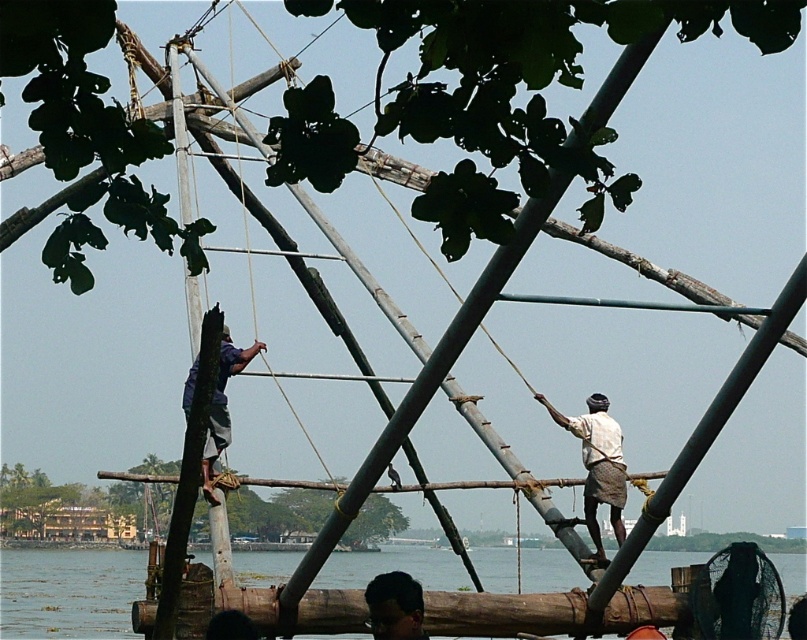
Is clear water at lower left positioned behind white cotton shirt at right?

Yes, it is behind white cotton shirt at right.

Who is taller, clear water at lower left or white cotton shirt at right?

white cotton shirt at right

Is point (31, 586) less distant than point (617, 461)?

No, it is behind (617, 461).

You are a GUI agent. You are given a task and a screenshot of the screen. Output one action in this format:
    pyautogui.click(x=<x>, y=<y>)
    Task: Click on the clear water at lower left
    
    Given the screenshot: What is the action you would take?
    pyautogui.click(x=67, y=592)

Is white cotton shirt at right above blue fabric shirt at upper center?

No, white cotton shirt at right is not above blue fabric shirt at upper center.

Can you confirm if white cotton shirt at right is thinner than blue fabric shirt at upper center?

No.

Locate an element on the screen. white cotton shirt at right is located at coordinates (596, 465).

Who is taller, blue fabric shirt at upper center or dark brown hair at lower center?

With more height is blue fabric shirt at upper center.

This screenshot has width=807, height=640. What are the coordinates of `blue fabric shirt at upper center` in the screenshot? It's located at (222, 408).